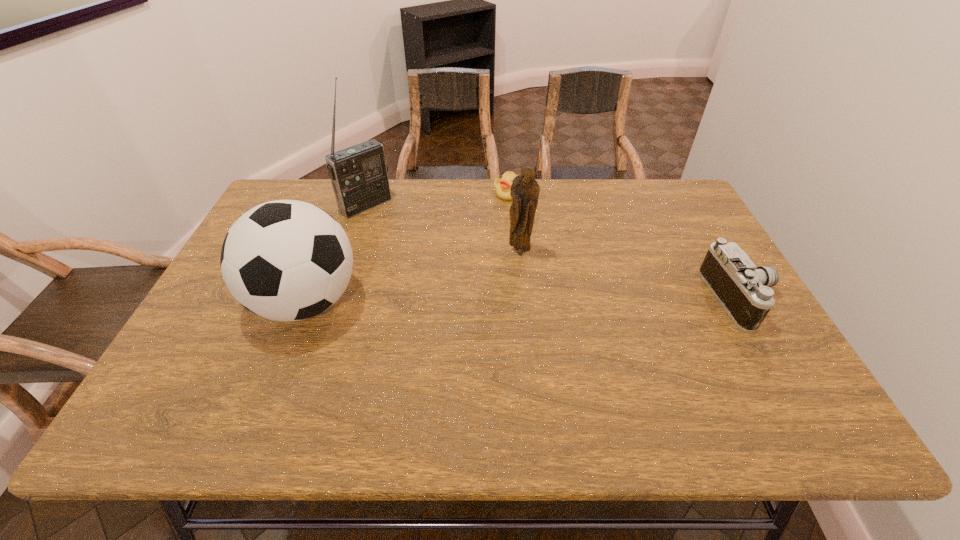
Identify the location of soccer ball. The width and height of the screenshot is (960, 540). (285, 260).

This screenshot has width=960, height=540. Find the location of `the rightmost object`. the rightmost object is located at coordinates (743, 290).

Where is `camera`? The width and height of the screenshot is (960, 540). camera is located at coordinates (743, 290).

Where is `the third farthest object`? the third farthest object is located at coordinates (525, 190).

I want to click on duckling, so click(502, 186).

You are a GUI agent. You are given a task and a screenshot of the screen. Output one action in this format:
    pyautogui.click(x=<x>, y=<y>)
    Task: Click on the radio receiver
    The image size is (960, 540).
    Given the screenshot: What is the action you would take?
    pyautogui.click(x=358, y=174)

You are a GUI agent. You are given a task and a screenshot of the screen. Output one action in this format:
    pyautogui.click(x=<x>, y=<y>)
    Task: Click on the blank space located on the front of the soccer ball
    
    Given the screenshot: What is the action you would take?
    pyautogui.click(x=277, y=376)

Identify the location of vacant space situated 0.340m on the front-facing side of the figurine. (429, 334).

Image resolution: width=960 pixels, height=540 pixels. In order to click on free region located 0.100m on the front-facing side of the figurine in this screenshot , I will do [x=492, y=279].

Where is `free space located 0.370m on the front-facing side of the figurine`? free space located 0.370m on the front-facing side of the figurine is located at coordinates (420, 342).